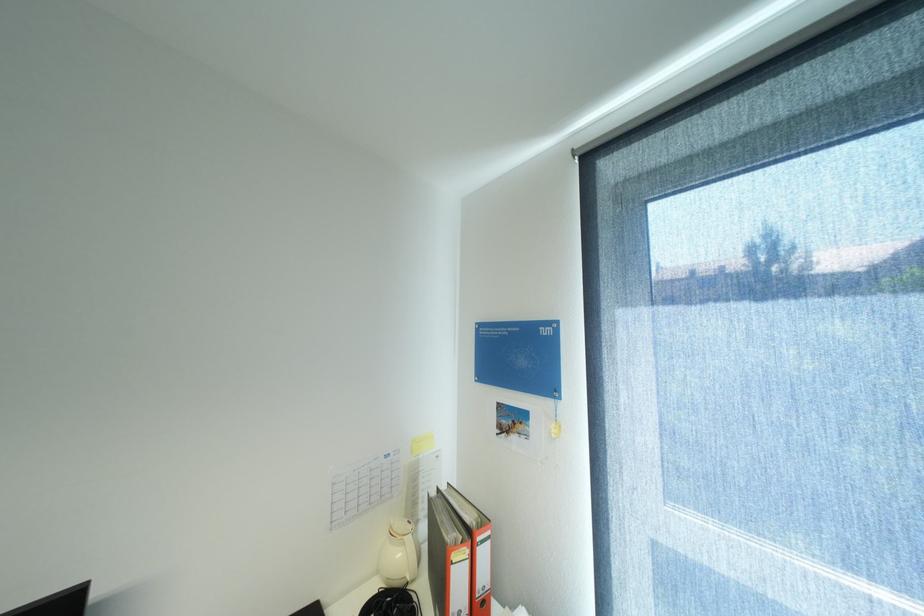
What do you see at coordinates (481, 607) in the screenshot? I see `the binder finger hole` at bounding box center [481, 607].